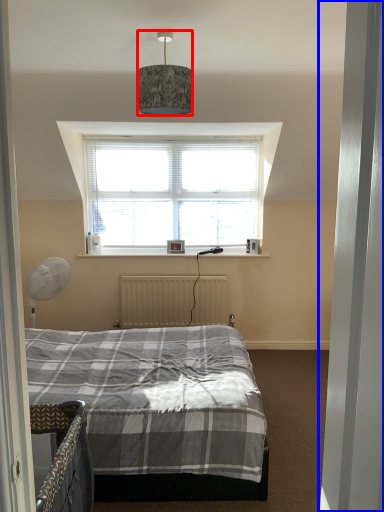
Question: Which object appears farthest to the camera in this image, lamp (highlighted by a red box) or door (highlighted by a blue box)?

Choices:
 (A) lamp
 (B) door

Answer: (A)